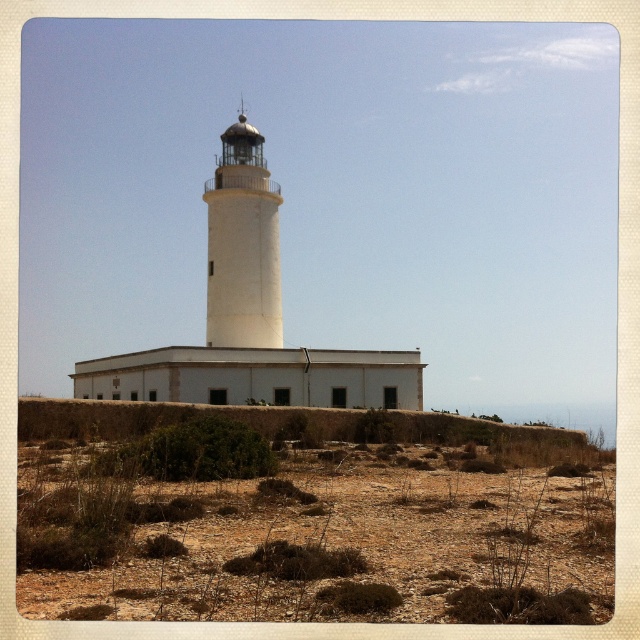
In the scene shown: You are a bird flying over the coastal area shown in the image. You want to land on the white smooth tower at center. From your current position above the brown gravelly dirt field at lower center, which direction should you fly to reach the tower?

The white smooth tower at center is taller than the brown gravelly dirt field at lower center, so you should fly upward to reach the tower from the lower elevation of the field.

Looking at this image, you are standing at the base of the lighthouse and looking towards the rectangular building with windows. There are two points marked on the ground in front of you. The first point is at coordinates point (204, 504) and the second is at point (227, 292). Which of these two points is closer to you?

Point (204, 504) is closer to the camera than point (227, 292), so the first point is closer to you.

You are a delivery drone that needs to land on the brown gravelly dirt field at lower center. The white smooth tower at center has a warning beacon that activates when drones come within 100 feet. Can you safely land on the field without triggering the beacon?

The brown gravelly dirt field at lower center and white smooth tower at center are 126.47 feet apart. Since the distance between them is greater than 100 feet, the drone can safely land on the brown gravelly dirt field at lower center without triggering the beacon.